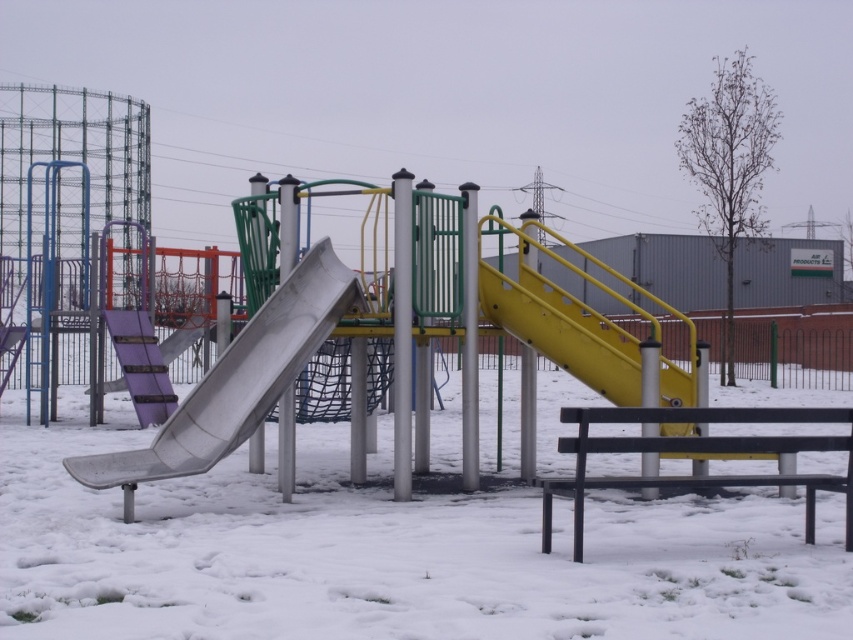
Question: Does white fluffy snow at center appear on the left side of metallic purple slide at center-left?

Choices:
 (A) no
 (B) yes

Answer: (A)

Question: Among these objects, which one is nearest to the camera?

Choices:
 (A) white fluffy snow at center
 (B) metallic smooth slide at center
 (C) yellow matte slide at center
 (D) metallic purple slide at center-left

Answer: (A)

Question: Which point is closer to the camera taking this photo?

Choices:
 (A) (167, 362)
 (B) (259, 360)
 (C) (79, 540)

Answer: (C)

Question: Is the position of white fluffy snow at center less distant than that of metallic purple slide at center-left?

Choices:
 (A) yes
 (B) no

Answer: (A)

Question: Among these points, which one is farthest from the camera?

Choices:
 (A) (680, 390)
 (B) (238, 424)

Answer: (A)

Question: Is metallic smooth slide at center above metallic purple slide at center-left?

Choices:
 (A) yes
 (B) no

Answer: (B)